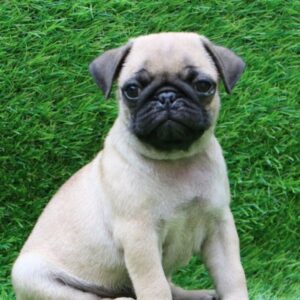
At what (x,y) coordinates should I click in order to perform the action: click on blond chest. Please return your answer as a coordinate pair (x, y). This screenshot has height=300, width=300. Looking at the image, I should click on (184, 224).